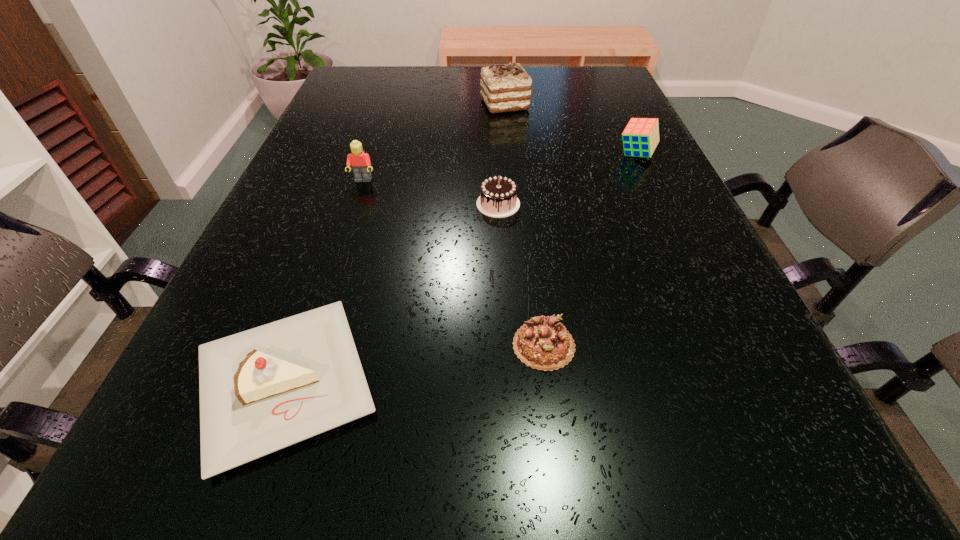
You are a GUI agent. You are given a task and a screenshot of the screen. Output one action in this format:
    pyautogui.click(x=<x>, y=<y>)
    Task: Click on the farthest chocolate cake
    The height and width of the screenshot is (540, 960).
    Given the screenshot: What is the action you would take?
    pyautogui.click(x=504, y=87)

What are the coordinates of `the tallest chocolate cake` in the screenshot? It's located at (504, 87).

You are a GUI agent. You are given a task and a screenshot of the screen. Output one action in this format:
    pyautogui.click(x=<x>, y=<y>)
    Task: Click on the Lego
    This screenshot has width=960, height=540.
    Given the screenshot: What is the action you would take?
    pyautogui.click(x=360, y=161)

Locate an element on the screen. cube is located at coordinates (640, 137).

You are a GUI agent. You are given a task and a screenshot of the screen. Output one action in this format:
    pyautogui.click(x=<x>, y=<y>)
    Task: Click on the rightmost object
    This screenshot has height=540, width=960.
    Given the screenshot: What is the action you would take?
    pyautogui.click(x=640, y=137)

Locate an element on the screen. The image size is (960, 540). the fourth farthest object is located at coordinates (498, 198).

This screenshot has height=540, width=960. What are the coordinates of `the second tallest chocolate cake` in the screenshot? It's located at (498, 198).

I want to click on cake, so click(261, 390).

Locate an element on the screen. the shortest object is located at coordinates (543, 343).

Where is `the shortest chocolate cake`? The width and height of the screenshot is (960, 540). the shortest chocolate cake is located at coordinates (543, 343).